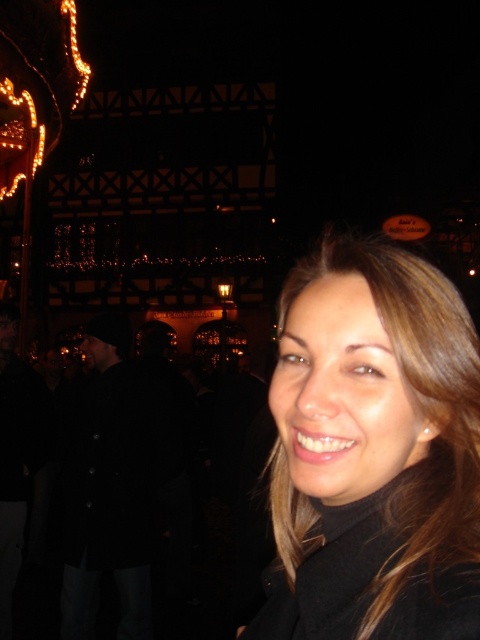
Looking at this image, does black matte coat at center have a lesser height compared to black wool coat at left?

Indeed, black matte coat at center has a lesser height compared to black wool coat at left.

Can you confirm if black matte coat at center is positioned above black wool coat at left?

Yes.

Locate an element on the screen. This screenshot has width=480, height=640. black matte coat at center is located at coordinates (373, 451).